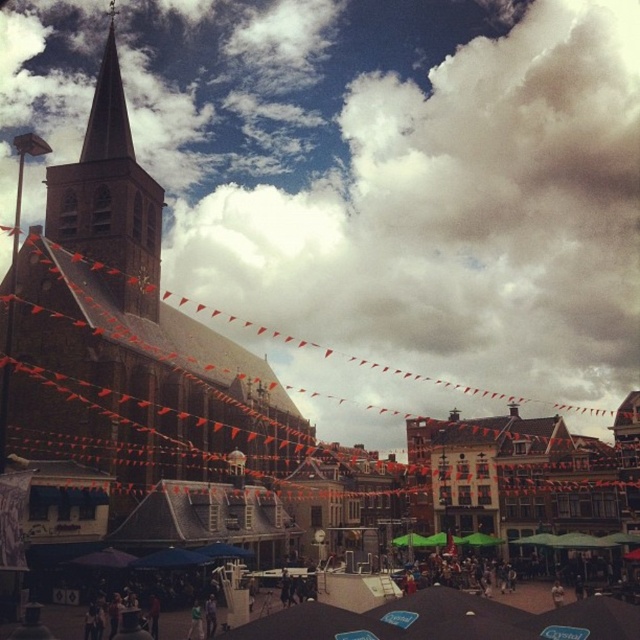
Question: Considering the real-world distances, which object is farthest from the cloudy sky at upper center?

Choices:
 (A) brown stone church at center
 (B) smooth gray steeple at upper left
 (C) brown stone steeple at upper left

Answer: (B)

Question: Estimate the real-world distances between objects in this image. Which object is closer to the smooth gray steeple at upper left?

Choices:
 (A) brown stone church at center
 (B) cloudy sky at upper center

Answer: (A)

Question: Does brown stone church at center lie in front of brown stone steeple at upper left?

Choices:
 (A) no
 (B) yes

Answer: (B)

Question: Does brown stone church at center have a greater width compared to smooth gray steeple at upper left?

Choices:
 (A) yes
 (B) no

Answer: (A)

Question: Is brown stone church at center to the right of brown stone steeple at upper left from the viewer's perspective?

Choices:
 (A) no
 (B) yes

Answer: (A)

Question: Which object is positioned farthest from the cloudy sky at upper center?

Choices:
 (A) brown stone church at center
 (B) brown stone steeple at upper left

Answer: (B)